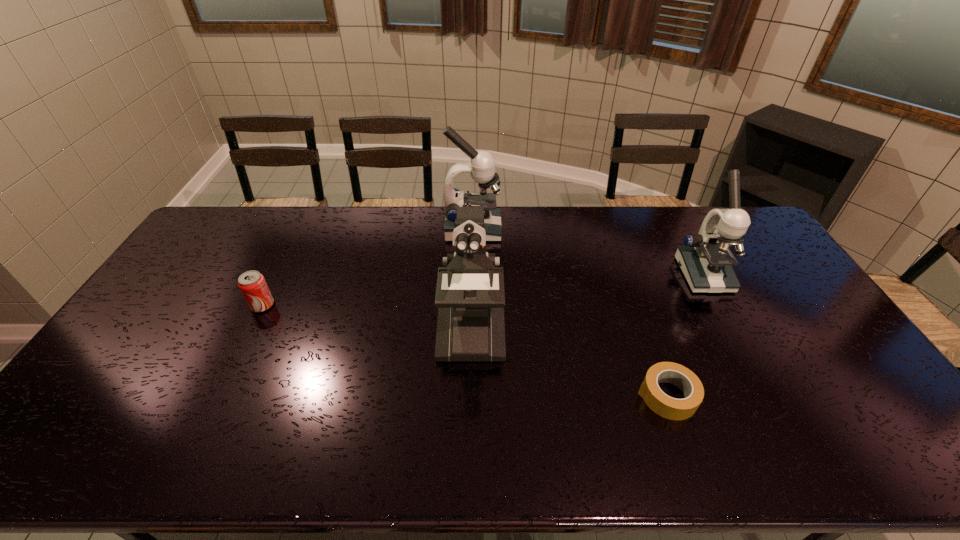
The height and width of the screenshot is (540, 960). I want to click on free space between the duct tape and the rightmost microscope, so click(684, 335).

Where is `vacant point located between the farthest object and the shortest object`? vacant point located between the farthest object and the shortest object is located at coordinates (569, 313).

Where is `vacant area that lies between the rightmost microscope and the second object from right to left`? The width and height of the screenshot is (960, 540). vacant area that lies between the rightmost microscope and the second object from right to left is located at coordinates (684, 335).

Identify the location of vacant point located between the nearest object and the farthest microscope. (569, 313).

Identify the location of object that is the second closest one to the farthest microscope. This screenshot has height=540, width=960. (252, 284).

You are a GUI agent. You are given a task and a screenshot of the screen. Output one action in this format:
    pyautogui.click(x=<x>, y=<y>)
    Task: Click on the object that can be found as the second closest to the soda can
    
    Given the screenshot: What is the action you would take?
    pyautogui.click(x=481, y=166)

This screenshot has width=960, height=540. I want to click on microscope that is the closest to the rightmost object, so click(x=481, y=166).

What are the coordinates of `microscope that is the second closest to the rightmost microscope` in the screenshot? It's located at (470, 297).

Identify the location of free space that satisfies the following two spatial constraints: 1. at the eyepiece of the rightmost object; 2. at the edge of the second object from right to left. This screenshot has height=540, width=960. (769, 396).

At what (x,y) coordinates should I click in order to perform the action: click on free spot that satisfies the following two spatial constraints: 1. on the back side of the farthest object; 2. on the right side of the soda can. Please return your answer as a coordinate pair (x, y). Looking at the image, I should click on (300, 230).